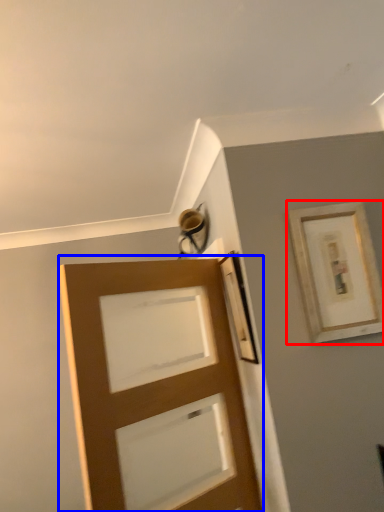
Question: Among these objects, which one is farthest to the camera, picture frame (highlighted by a red box) or door (highlighted by a blue box)?

Choices:
 (A) picture frame
 (B) door

Answer: (A)